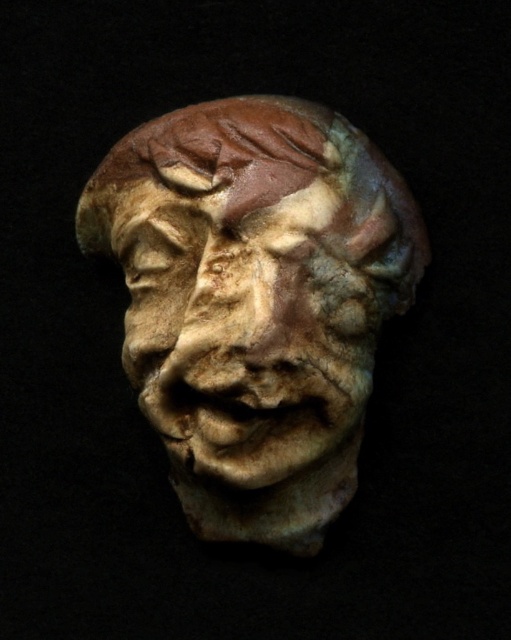
You are an art restorer examining the matte clay sculpture at center and the matte clay face at center. Which part should you work on first if you need to address the weathered surface starting from the top?

The matte clay sculpture at center should be worked on first since it is located above the matte clay face at center, meaning the weathering would start from the top downwards.

You are an art conservator standing 5 feet away from the matte clay sculpture at center. You need to move closer to examine its surface details. Can you safely approach within 3 feet without violating the recommended safety distance of 4 feet for handling delicate sculptures?

The distance between the matte clay sculpture at center and the camera is 3.96 feet. Since you are already standing 5 feet away, moving closer to 3 feet would bring you within 3 feet, which is 0.04 feet less than the recommended 4 feet. Therefore, you would be violating the safety distance and should not approach closer than 4 feet.

You are an art conservator working with a 1.5 inch wide tool. You need to apply a protective coating to the matte clay sculpture at center and the matte clay face at center. Can you fit your tool between them without touching either?

The matte clay sculpture at center is 0.52 inches from the matte clay face at center. Since your tool is 1.5 inches wide, it cannot fit between them as the distance is smaller than the tool width. You need a narrower tool.